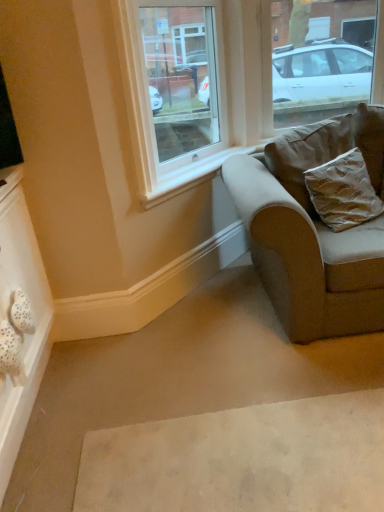
Question: From a real-world perspective, is white fabric drawer at lower left above or below clear glass window at upper center, the 1th window when ordered from left to right?

Choices:
 (A) below
 (B) above

Answer: (A)

Question: Based on their sizes in the image, would you say white fabric drawer at lower left is bigger or smaller than clear glass window at upper center, the 1th window when ordered from left to right?

Choices:
 (A) small
 (B) big

Answer: (A)

Question: Estimate the real-world distances between objects in this image. Which object is closer to the beige fabric couch at right?

Choices:
 (A) clear glass window at upper right, the 1th window from the right
 (B) clear glass window at upper center, the 1th window when ordered from left to right
 (C) white fabric drawer at lower left
 (D) gold textured pillow at right

Answer: (D)

Question: Considering the real-world distances, which object is closest to the beige fabric couch at right?

Choices:
 (A) white fabric drawer at lower left
 (B) gold textured pillow at right
 (C) clear glass window at upper right, the 1th window from the right
 (D) clear glass window at upper center, the 1th window when ordered from left to right

Answer: (B)